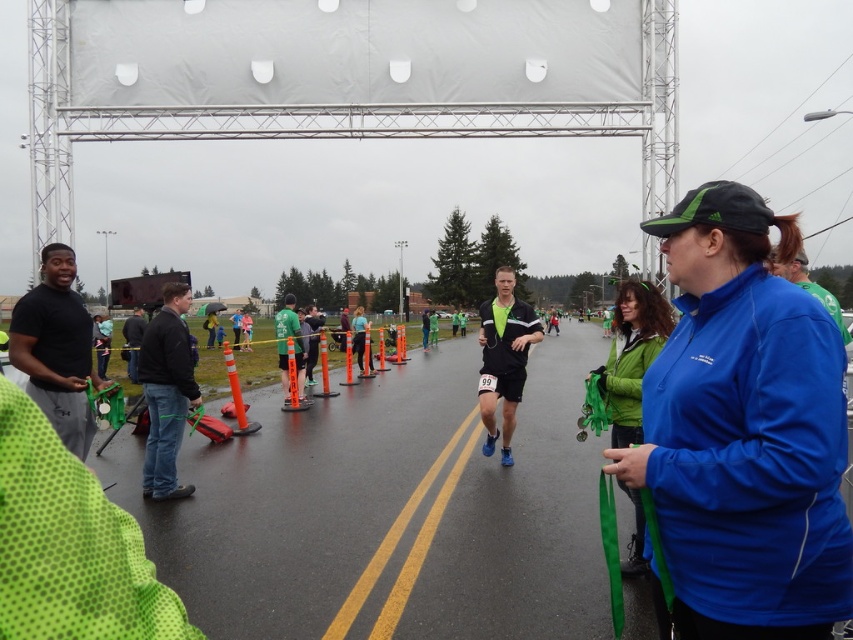
Can you confirm if blue fleece jacket at right is bigger than green fleece jacket at right?

Incorrect, blue fleece jacket at right is not larger than green fleece jacket at right.

What do you see at coordinates (744, 429) in the screenshot?
I see `blue fleece jacket at right` at bounding box center [744, 429].

Is point (816, 588) positioned before point (635, 404)?

Yes.

The image size is (853, 640). In order to click on blue fleece jacket at right in this screenshot , I will do `click(744, 429)`.